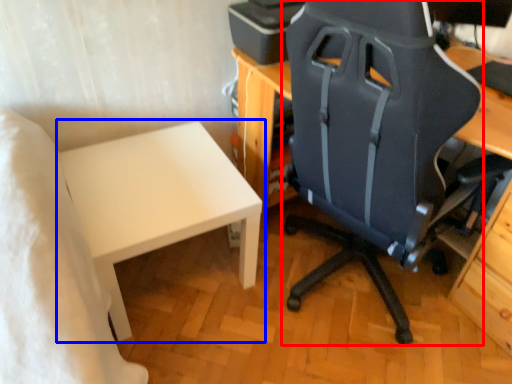
Question: Which point is further to the camera, chair (highlighted by a red box) or table (highlighted by a blue box)?

Choices:
 (A) chair
 (B) table

Answer: (B)